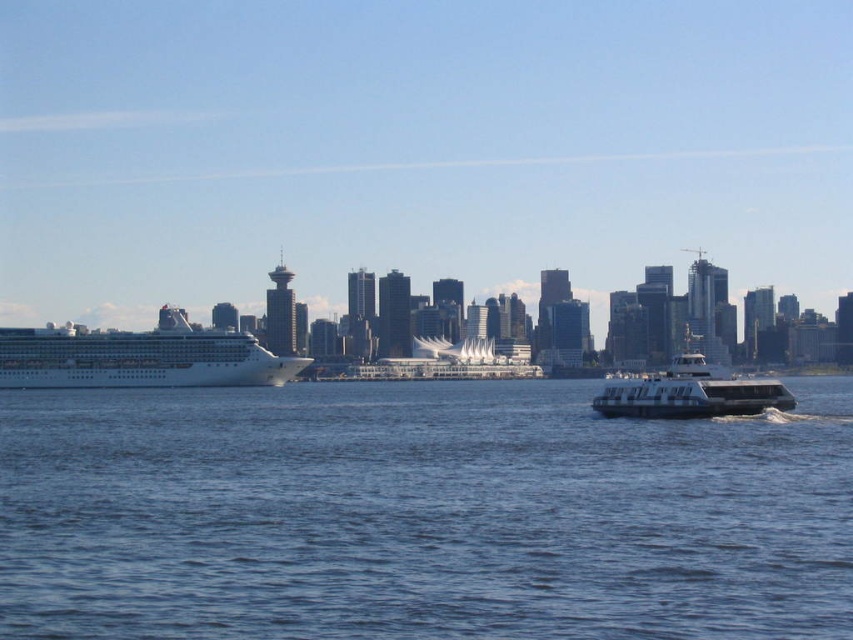
Is white glossy cruise ship at left positioned before white glossy building at center?

Yes, it is.

Who is higher up, white glossy cruise ship at left or white glossy building at center?

white glossy cruise ship at left is higher up.

What do you see at coordinates (138, 356) in the screenshot?
I see `white glossy cruise ship at left` at bounding box center [138, 356].

Locate an element on the screen. The height and width of the screenshot is (640, 853). white glossy cruise ship at left is located at coordinates (138, 356).

Can you confirm if metallic gray ferry at lower right is taller than white glossy building at center?

Correct, metallic gray ferry at lower right is much taller as white glossy building at center.

Can you confirm if metallic gray ferry at lower right is bigger than white glossy building at center?

Yes.

What do you see at coordinates (689, 392) in the screenshot? I see `metallic gray ferry at lower right` at bounding box center [689, 392].

Where is `metallic gray ferry at lower right`? metallic gray ferry at lower right is located at coordinates (689, 392).

Between blue water at center and white glossy cruise ship at left, which one appears on the right side from the viewer's perspective?

blue water at center

Image resolution: width=853 pixels, height=640 pixels. What are the coordinates of `blue water at center` in the screenshot? It's located at (421, 515).

Find the location of a particular element. Image resolution: width=853 pixels, height=640 pixels. blue water at center is located at coordinates (421, 515).